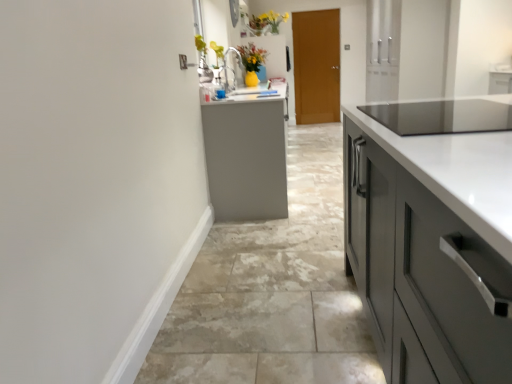
Question: Can you confirm if yellow matte vase at upper center is smaller than gray tile floor at center?

Choices:
 (A) no
 (B) yes

Answer: (B)

Question: Does yellow matte vase at upper center have a lesser height compared to gray tile floor at center?

Choices:
 (A) yes
 (B) no

Answer: (B)

Question: Is gray tile floor at center surrounded by yellow matte vase at upper center?

Choices:
 (A) no
 (B) yes

Answer: (A)

Question: From the image's perspective, is yellow matte vase at upper center above gray tile floor at center?

Choices:
 (A) no
 (B) yes

Answer: (B)

Question: Is yellow matte vase at upper center far from gray tile floor at center?

Choices:
 (A) yes
 (B) no

Answer: (A)

Question: Is yellow matte vase at upper center bigger than gray tile floor at center?

Choices:
 (A) yes
 (B) no

Answer: (B)

Question: Can you confirm if brown wooden door at center is thinner than gray tile floor at center?

Choices:
 (A) yes
 (B) no

Answer: (A)

Question: Is brown wooden door at center shorter than gray tile floor at center?

Choices:
 (A) no
 (B) yes

Answer: (A)

Question: Is brown wooden door at center touching gray tile floor at center?

Choices:
 (A) no
 (B) yes

Answer: (A)

Question: Does brown wooden door at center have a smaller size compared to gray tile floor at center?

Choices:
 (A) no
 (B) yes

Answer: (B)

Question: Can you confirm if brown wooden door at center is positioned to the left of gray tile floor at center?

Choices:
 (A) no
 (B) yes

Answer: (B)

Question: Is brown wooden door at center surrounding gray tile floor at center?

Choices:
 (A) no
 (B) yes

Answer: (A)

Question: Is yellow matte vase at upper center further to the viewer compared to brown wooden door at center?

Choices:
 (A) no
 (B) yes

Answer: (A)